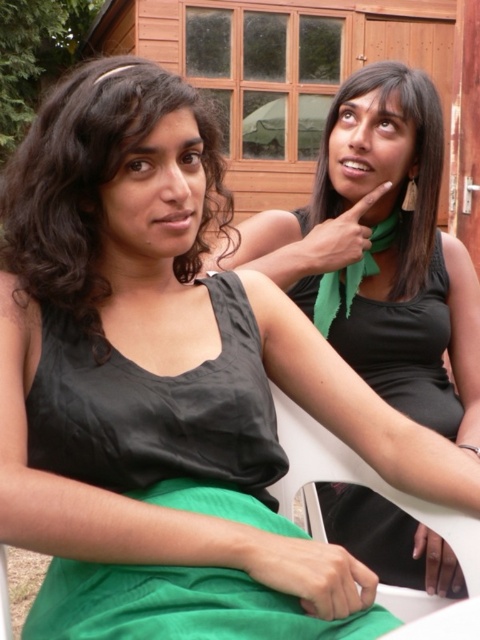
The width and height of the screenshot is (480, 640). Describe the element at coordinates (95, 182) in the screenshot. I see `matte black dress at left` at that location.

Can you confirm if matte black dress at left is positioned to the right of black matte dress at center?

→ In fact, matte black dress at left is to the left of black matte dress at center.

Is point (74, 163) farther from viewer compared to point (310, 316)?

No, it is not.

Where is `matte black dress at left`? matte black dress at left is located at coordinates (95, 182).

Does point (417, 310) come behind point (327, 115)?

That is False.

Consider the image. Is black matte dress at center to the right of green matte scarf at upper right from the viewer's perspective?

Correct, you'll find black matte dress at center to the right of green matte scarf at upper right.

Where is `black matte dress at center`? The image size is (480, 640). black matte dress at center is located at coordinates (405, 348).

You are a GUI agent. You are given a task and a screenshot of the screen. Output one action in this format:
    pyautogui.click(x=<x>, y=<y>)
    Task: Click on the black matte dress at center
    The image size is (480, 640).
    Given the screenshot: What is the action you would take?
    pyautogui.click(x=405, y=348)

Who is lower down, matte black dress at left or green matte scarf at upper right?

matte black dress at left

Looking at this image, is matte black dress at left bigger than green matte scarf at upper right?

Yes, matte black dress at left is bigger than green matte scarf at upper right.

The image size is (480, 640). What are the coordinates of `matte black dress at left` in the screenshot? It's located at (95, 182).